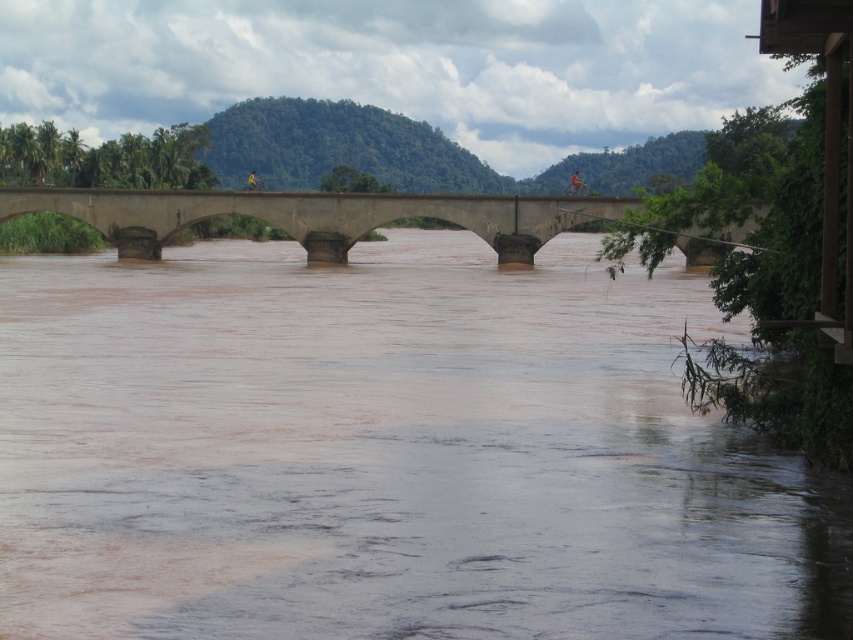
Question: Is brown muddy water at center thinner than concrete bridge at center?

Choices:
 (A) no
 (B) yes

Answer: (B)

Question: Which object appears closest to the camera in this image?

Choices:
 (A) concrete bridge at center
 (B) brown muddy water at center

Answer: (B)

Question: Observing the image, what is the correct spatial positioning of brown muddy water at center in reference to concrete bridge at center?

Choices:
 (A) right
 (B) left

Answer: (B)

Question: Which object appears farthest from the camera in this image?

Choices:
 (A) brown muddy water at center
 (B) concrete bridge at center

Answer: (B)

Question: Which object is closer to the camera taking this photo?

Choices:
 (A) concrete bridge at center
 (B) brown muddy water at center

Answer: (B)

Question: Is brown muddy water at center thinner than concrete bridge at center?

Choices:
 (A) yes
 (B) no

Answer: (A)